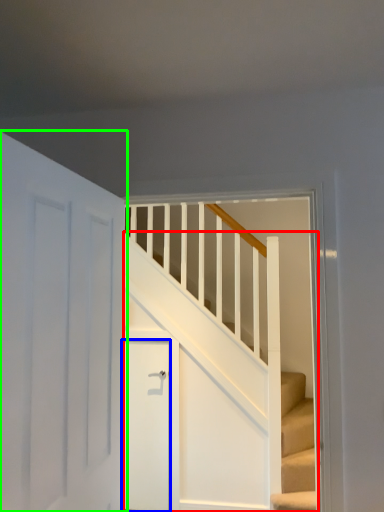
Question: Which is farther away from stairs (highlighted by a red box)? door (highlighted by a blue box) or door (highlighted by a green box)?

Choices:
 (A) door
 (B) door

Answer: (B)